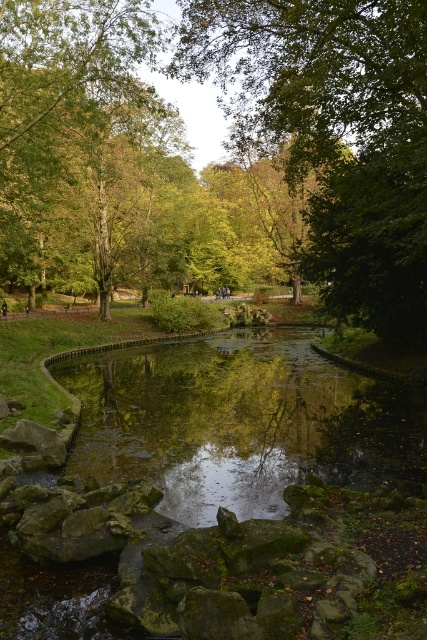
Does green leafy tree at center appear over green reflective water at center?

Yes, green leafy tree at center is above green reflective water at center.

Between point (404, 54) and point (268, 364), which one is positioned in front?

Positioned in front is point (404, 54).

Image resolution: width=427 pixels, height=640 pixels. In order to click on green leafy tree at center in this screenshot , I will do pos(335,132).

Which of these two, green reflective water at center or green leafy tree at upper left, stands shorter?

green reflective water at center

Does green reflective water at center lie in front of green leafy tree at upper left?

That is True.

Is point (408, 448) more distant than point (15, 220)?

No.

In order to click on green reflective water at center in this screenshot , I will do 240,422.

Can you confirm if green leafy tree at center is positioned below dark brown leather jacket at center?

Incorrect, green leafy tree at center is not positioned below dark brown leather jacket at center.

Is point (322, 109) positioned after point (2, 305)?

No, it is in front of (2, 305).

I want to click on green leafy tree at center, so click(335, 132).